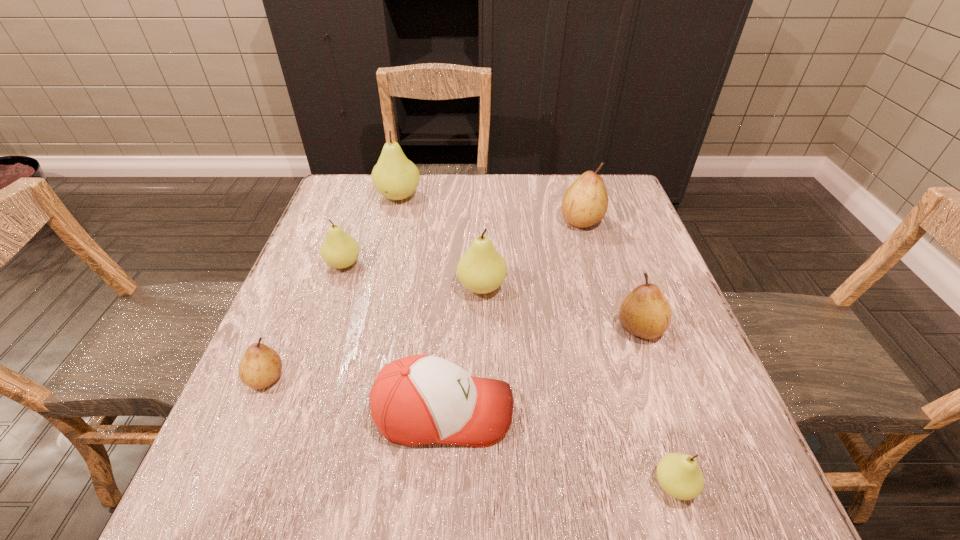
You are a GUI agent. You are given a task and a screenshot of the screen. Output one action in this format:
    pyautogui.click(x=<x>, y=<y>)
    Task: Click on the leftmost brown pear
    This screenshot has width=960, height=540.
    Given the screenshot: What is the action you would take?
    pyautogui.click(x=261, y=366)

At what (x,y) coordinates should I click in order to perform the action: click on the nearest green pear. Please return your answer as a coordinate pair (x, y). Image resolution: width=960 pixels, height=540 pixels. Looking at the image, I should click on (680, 476).

In order to click on the smallest green pear in this screenshot , I will do `click(680, 476)`.

Find the location of `free space located on the right of the farthest green pear`. free space located on the right of the farthest green pear is located at coordinates (470, 197).

Where is `vacant space located 0.100m on the right of the farthest brown pear`? The image size is (960, 540). vacant space located 0.100m on the right of the farthest brown pear is located at coordinates (640, 220).

This screenshot has height=540, width=960. I want to click on free space located 0.200m on the left of the fourth pear from right to left, so click(x=371, y=287).

I want to click on vacant space located 0.360m on the back of the third biggest green pear, so click(373, 178).

Locate an element on the screen. This screenshot has height=540, width=960. vacant space positioned on the front of the fifth farthest pear is located at coordinates (654, 367).

Identify the location of vacant space located on the front-facing side of the baseball cap. Image resolution: width=960 pixels, height=540 pixels. (671, 411).

The height and width of the screenshot is (540, 960). I want to click on vacant region located 0.110m on the back of the smallest brown pear, so click(x=291, y=319).